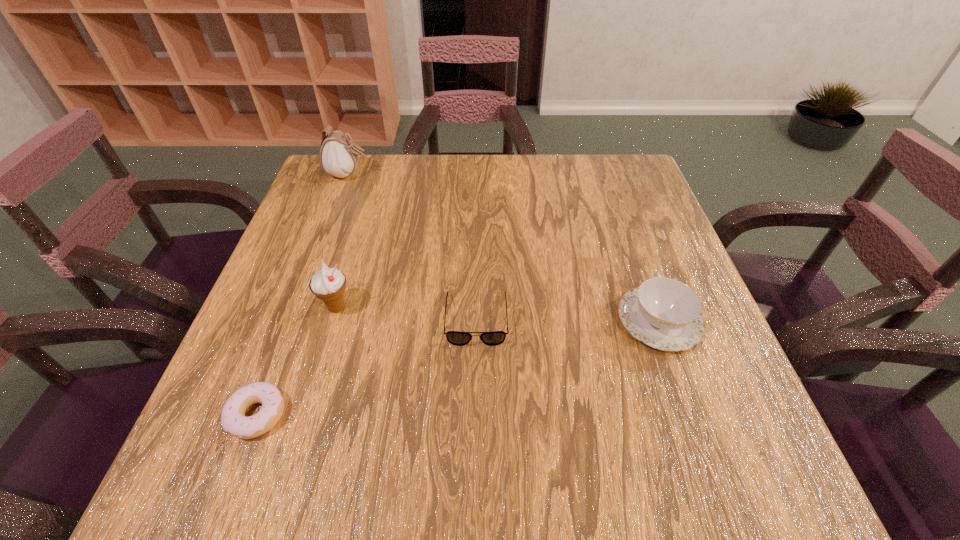
Image resolution: width=960 pixels, height=540 pixels. Identify the location of vacant point that satisfies the following two spatial constraints: 1. on the back side of the icecream; 2. on the right side of the doughnut. (298, 307).